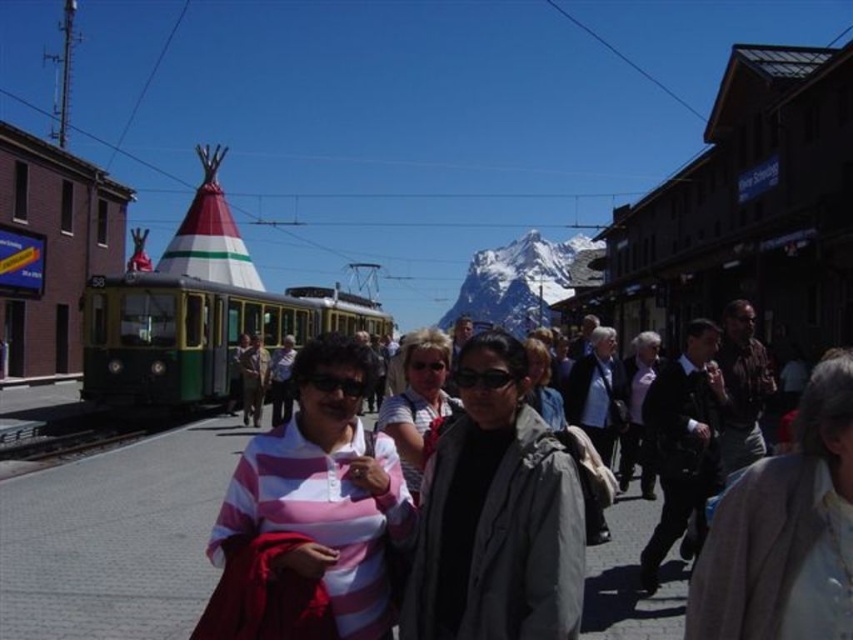
You are standing at the point marked as point [828,376] in the image. If you want to take a photo of the train station, which is 204.38 feet away from you, where should you position yourself to capture the entire scene in one shot?

Since the point [828,376] is 204.38 feet away from the camera, you should position yourself at the camera location to capture the entire scene in one shot.